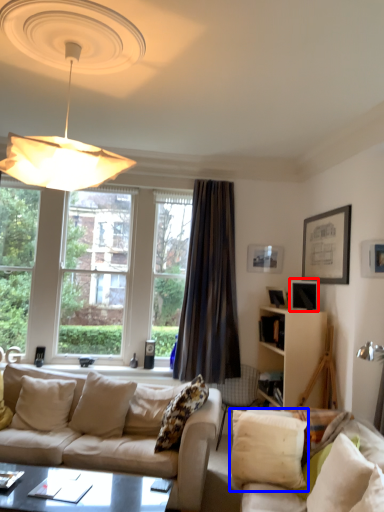
Question: Which point is closer to the camera, picture frame (highlighted by a red box) or pillow (highlighted by a blue box)?

Choices:
 (A) picture frame
 (B) pillow

Answer: (B)